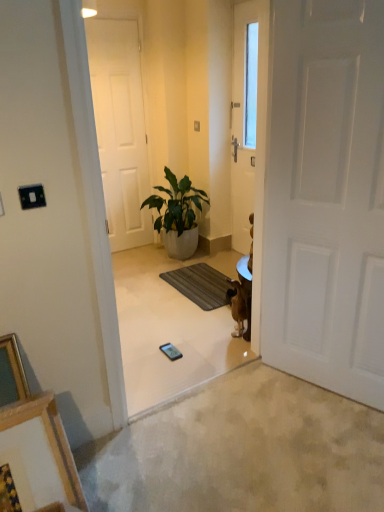
The width and height of the screenshot is (384, 512). Describe the element at coordinates (201, 285) in the screenshot. I see `dark gray textured mat at center` at that location.

Describe the element at coordinates (326, 196) in the screenshot. This screenshot has height=512, width=384. I see `white matte door at right, the second door when ordered from back to front` at that location.

Where is `white matte door at right, the second door when ordered from left to right`? Image resolution: width=384 pixels, height=512 pixels. white matte door at right, the second door when ordered from left to right is located at coordinates (326, 196).

Locate an element on the screen. The width and height of the screenshot is (384, 512). black glossy mobile phone at center is located at coordinates (171, 351).

Where is `brown fur dog at center-right`? This screenshot has height=512, width=384. brown fur dog at center-right is located at coordinates (241, 309).

Identify the location of dark gray textured mat at center. (201, 285).

Considering the sizes of white matte door at center, which is the second door from right to left, and black glossy mobile phone at center in the image, is white matte door at center, which is the second door from right to left, wider or thinner than black glossy mobile phone at center?

In the image, white matte door at center, which is the second door from right to left, appears to be more narrow than black glossy mobile phone at center.

Is white matte door at center, positioned as the second door in front-to-back order, behind black glossy mobile phone at center?

Yes, white matte door at center, positioned as the second door in front-to-back order, is further from the viewer.

From the image's perspective, who appears lower, white matte door at center, which is the second door from right to left, or black glossy mobile phone at center?

black glossy mobile phone at center.

How different are the orientations of white matte door at center, positioned as the second door in front-to-back order, and black glossy mobile phone at center in degrees?

The angle between the facing direction of white matte door at center, positioned as the second door in front-to-back order, and the facing direction of black glossy mobile phone at center is 2.5 degrees.

Considering the sizes of objects green leafy plant in white pot at center and dark gray textured mat at center in the image provided, who is taller, green leafy plant in white pot at center or dark gray textured mat at center?

With more height is green leafy plant in white pot at center.

Can you see green leafy plant in white pot at center touching dark gray textured mat at center?

green leafy plant in white pot at center and dark gray textured mat at center are clearly separated.

Is green leafy plant in white pot at center positioned behind dark gray textured mat at center?

Yes, it is.

How much distance is there between green leafy plant in white pot at center and dark gray textured mat at center?

green leafy plant in white pot at center and dark gray textured mat at center are 18.49 inches apart from each other.

Considering the sizes of white matte door at center, positioned as the second door in front-to-back order, and brown fur dog at center-right in the image, is white matte door at center, positioned as the second door in front-to-back order, bigger or smaller than brown fur dog at center-right?

Clearly, white matte door at center, positioned as the second door in front-to-back order, is larger in size than brown fur dog at center-right.

From a real-world perspective, is white matte door at center, which is the second door from right to left, on top of brown fur dog at center-right?

Yes, from a real-world perspective, white matte door at center, which is the second door from right to left, is on top of brown fur dog at center-right.

Between white matte door at center, which is counted as the 1th door, starting from the left, and brown fur dog at center-right, which one appears on the right side from the viewer's perspective?

brown fur dog at center-right is more to the right.

Are white matte door at center, which is the second door from right to left, and brown fur dog at center-right beside each other?

No.

Which object is thinner, dark gray textured mat at center or wooden picture frame at lower left?

With smaller width is wooden picture frame at lower left.

How different are the orientations of dark gray textured mat at center and wooden picture frame at lower left in degrees?

The angular difference between dark gray textured mat at center and wooden picture frame at lower left is 93.1 degrees.

Is wooden picture frame at lower left inside dark gray textured mat at center?

No, dark gray textured mat at center does not contain wooden picture frame at lower left.

Looking at this image, is brown fur dog at center-right smaller than wooden picture frame at lower left?

Yes.

From a real-world perspective, is brown fur dog at center-right on top of wooden picture frame at lower left?

No.

Is brown fur dog at center-right at the left side of wooden picture frame at lower left?

In fact, brown fur dog at center-right is to the right of wooden picture frame at lower left.

Does green leafy plant in white pot at center touch brown fur dog at center-right?

No, green leafy plant in white pot at center is not making contact with brown fur dog at center-right.

Can you tell me how much green leafy plant in white pot at center and brown fur dog at center-right differ in facing direction?

They differ by 25.5 degrees in their facing directions.

Visually, is green leafy plant in white pot at center positioned to the left or to the right of brown fur dog at center-right?

green leafy plant in white pot at center is to the left of brown fur dog at center-right.

Would you say green leafy plant in white pot at center is outside brown fur dog at center-right?

That's correct, green leafy plant in white pot at center is outside of brown fur dog at center-right.

How distant is white matte door at center, which is the second door from right to left, from white matte door at right, the second door when ordered from back to front?

white matte door at center, which is the second door from right to left, is 2.23 meters away from white matte door at right, the second door when ordered from back to front.

Considering the relative sizes of white matte door at center, which is counted as the 1th door, starting from the back, and white matte door at right, the 1th door viewed from the right, in the image provided, is white matte door at center, which is counted as the 1th door, starting from the back, taller than white matte door at right, the 1th door viewed from the right,?

Yes.

Between white matte door at center, which is the second door from right to left, and white matte door at right, the 1th door when ordered from front to back, which one is positioned behind?

white matte door at center, which is the second door from right to left, is more distant.

Is point (115, 121) closer or farther from the camera than point (282, 3)?

Point (115, 121).

This screenshot has width=384, height=512. In order to click on mobile phone that appears in front of the white matte door at center, which is the second door from right to left in this screenshot , I will do `click(171, 351)`.

What are the coordinates of `houseplant behind the dark gray textured mat at center` in the screenshot? It's located at (178, 215).

Considering their positions, is dark gray textured mat at center positioned closer to white matte door at right, the 1th door viewed from the right, than black glossy mobile phone at center?

black glossy mobile phone at center.

Looking at the image, which one is located further to dark gray textured mat at center, green leafy plant in white pot at center or white matte door at center, which is the second door from right to left?

white matte door at center, which is the second door from right to left, lies further to dark gray textured mat at center than the other object.

When comparing their distances from black glossy mobile phone at center, does wooden picture frame at lower left or dark gray textured mat at center seem closer?

Among the two, dark gray textured mat at center is located nearer to black glossy mobile phone at center.

Considering their positions, is brown fur dog at center-right positioned closer to white matte door at right, the 1th door viewed from the right, than wooden picture frame at lower left?

brown fur dog at center-right.

Which object lies further to the anchor point green leafy plant in white pot at center, wooden picture frame at lower left or white matte door at center, which is counted as the 1th door, starting from the back?

The object further to green leafy plant in white pot at center is wooden picture frame at lower left.

Considering their positions, is brown fur dog at center-right positioned closer to wooden picture frame at lower left than dark gray textured mat at center?

Based on the image, brown fur dog at center-right appears to be nearer to wooden picture frame at lower left.

In the scene shown: Looking at the image, which one is located further to brown fur dog at center-right, white matte door at right, the second door when ordered from left to right, or wooden picture frame at lower left?

wooden picture frame at lower left is positioned further to the anchor brown fur dog at center-right.

In the scene shown: Considering their positions, is dark gray textured mat at center positioned closer to white matte door at right, the second door when ordered from left to right, than wooden picture frame at lower left?

Based on the image, dark gray textured mat at center appears to be nearer to white matte door at right, the second door when ordered from left to right.

The image size is (384, 512). In order to click on doormat between green leafy plant in white pot at center and black glossy mobile phone at center in the up-down direction in this screenshot , I will do `click(201, 285)`.

Locate an element on the screen. doormat between white matte door at right, the 1th door viewed from the right, and white matte door at center, which is counted as the 1th door, starting from the left, from front to back is located at coordinates (201, 285).

The image size is (384, 512). I want to click on mobile phone between white matte door at right, the second door when ordered from left to right, and white matte door at center, which is counted as the 1th door, starting from the left, in the front-back direction, so click(x=171, y=351).

The width and height of the screenshot is (384, 512). I want to click on mobile phone between wooden picture frame at lower left and brown fur dog at center-right from front to back, so click(171, 351).